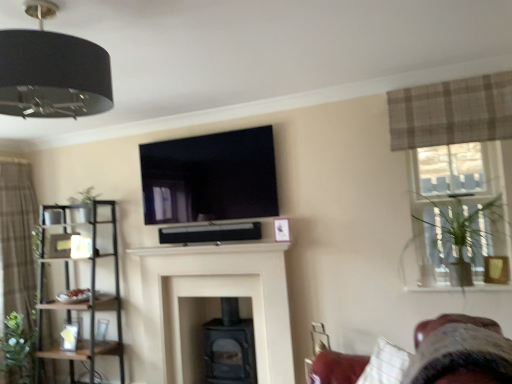
Find the location of a particular element. This screenshot has height=384, width=512. black matte fireplace at center, which is the first fireplace from back to front is located at coordinates (206, 320).

What is the approximate width of clear glass window at upper right?

clear glass window at upper right is 2.96 inches in width.

What do you see at coordinates (17, 242) in the screenshot?
I see `brown textured curtain at left, the 1th curtain positioned from the left` at bounding box center [17, 242].

Image resolution: width=512 pixels, height=384 pixels. In order to click on black matte fireplace at center, which is the first fireplace from back to front in this screenshot , I will do `click(206, 320)`.

Considering the relative sizes of green matte plant at upper left, which appears as the second plant when ordered from the bottom, and black glossy tv at upper center in the image provided, is green matte plant at upper left, which appears as the second plant when ordered from the bottom, bigger than black glossy tv at upper center?

No, green matte plant at upper left, which appears as the second plant when ordered from the bottom, is not bigger than black glossy tv at upper center.

From a real-world perspective, which object stands above the other?

black glossy tv at upper center.

Considering their positions, is green matte plant at upper left, which appears as the second plant when ordered from the bottom, located in front of or behind black glossy tv at upper center?

Clearly, green matte plant at upper left, which appears as the second plant when ordered from the bottom, is behind black glossy tv at upper center.

Is brown textured curtain at left, which appears as the 2th curtain when viewed from the front, completely or partially inside clear glass window at upper right?

No.

Is point (452, 231) closer or farther from the camera than point (18, 250)?

Point (452, 231).

How distant is clear glass window at upper right from brown textured curtain at left, which appears as the 2th curtain when viewed from the front?

3.60 meters.

Identify the location of window located above the brown textured curtain at left, the first curtain ordered from the bottom (from the image's perspective). This screenshot has width=512, height=384. (452, 213).

Does clear glass window at upper right touch green matte plant at upper left, which appears as the second plant when ordered from the bottom?

No, clear glass window at upper right is not making contact with green matte plant at upper left, which appears as the second plant when ordered from the bottom.

Considering the sizes of clear glass window at upper right and green matte plant at upper left, the second plant viewed from the left, in the image, is clear glass window at upper right bigger or smaller than green matte plant at upper left, the second plant viewed from the left,?

Considering their sizes, clear glass window at upper right takes up more space than green matte plant at upper left, the second plant viewed from the left.

Is green matte plant at upper left, arranged as the first plant when viewed from the right, at the back of clear glass window at upper right?

clear glass window at upper right is not turned away from green matte plant at upper left, arranged as the first plant when viewed from the right.

The width and height of the screenshot is (512, 384). Identify the location of plant above the clear glass window at upper right (from a real-world perspective). (85, 203).

Identify the location of shelf behind the clear glass window at upper right. (90, 278).

Considering the positions of objects clear glass window at upper right and black metal shelf at left in the image provided, who is more to the right, clear glass window at upper right or black metal shelf at left?

clear glass window at upper right is more to the right.

Is black metal shelf at left surrounded by clear glass window at upper right?

No, black metal shelf at left is located outside of clear glass window at upper right.

From the image's perspective, between brown textured curtain at left, the first curtain ordered from the bottom, and black matte fireplace at center, which is the first fireplace from back to front, which one is located above?

brown textured curtain at left, the first curtain ordered from the bottom.

Identify the location of the 2nd fireplace below the brown textured curtain at left, the first curtain ordered from the bottom (from the image's perspective). (206, 320).

Can you confirm if brown textured curtain at left, the 1th curtain positioned from the left, is shorter than black matte fireplace at center, which is the first fireplace from back to front?

No, brown textured curtain at left, the 1th curtain positioned from the left, is not shorter than black matte fireplace at center, which is the first fireplace from back to front.

Does black glossy tv at upper center turn towards brown textured curtain at left, the second curtain positioned from the right?

No, black glossy tv at upper center does not turn towards brown textured curtain at left, the second curtain positioned from the right.

Identify the location of window screen lying on the right of brown textured curtain at left, the first curtain ordered from the bottom. (210, 177).

From the image's perspective, which one is positioned higher, black glossy tv at upper center or brown textured curtain at left, which appears as the 2th curtain when viewed from the front?

black glossy tv at upper center, from the image's perspective.

From a real-world perspective, between black glossy tv at upper center and brown textured curtain at left, the first curtain in the back-to-front sequence, who is vertically higher?

From a 3D spatial view, black glossy tv at upper center is above.

In terms of size, does matte black fireplace at center, the first fireplace from the front, appear bigger or smaller than clear glass window at upper right?

matte black fireplace at center, the first fireplace from the front, is bigger than clear glass window at upper right.

From the image's perspective, does matte black fireplace at center, which ranks as the 2th fireplace in back-to-front order, appear lower than clear glass window at upper right?

Yes, from the image's perspective, matte black fireplace at center, which ranks as the 2th fireplace in back-to-front order, is beneath clear glass window at upper right.

Considering the positions of points (139, 262) and (462, 148), is point (139, 262) farther from camera compared to point (462, 148)?

Yes, point (139, 262) is farther from viewer.

Is matte black fireplace at center, the first fireplace from the front, far away from clear glass window at upper right?

Absolutely, matte black fireplace at center, the first fireplace from the front, is distant from clear glass window at upper right.

This screenshot has height=384, width=512. Identify the location of window screen in front of the green matte plant at upper left, which appears as the second plant when ordered from the bottom. point(210,177).

At what (x,y) coordinates should I click in order to perform the action: click on the 2nd curtain to the left when counting from the clear glass window at upper right. Please return your answer as a coordinate pair (x, y). Looking at the image, I should click on (17, 242).

Based on their spatial positions, is green matte plant at upper left, which appears as the second plant when ordered from the bottom, or matte black fireplace at center, the first fireplace from the front, further from black metal shelf at left?

Among the two, matte black fireplace at center, the first fireplace from the front, is located further to black metal shelf at left.

From the image, which object appears to be nearer to white matte fireplace at center, plush fabric swivel chair at lower right or black glossy tv at upper center?

black glossy tv at upper center lies closer to white matte fireplace at center than the other object.

Estimate the real-world distances between objects in this image. Which object is closer to plaid fabric curtain at upper right, the 1th curtain positioned from the top, black fabric lampshade at upper left or clear glass window at upper right?

clear glass window at upper right is positioned closer to the anchor plaid fabric curtain at upper right, the 1th curtain positioned from the top.

Looking at the image, which one is located further to plaid fabric curtain at upper right, the 1th curtain positioned from the top, green matte plant at upper left, which appears as the second plant when ordered from the bottom, or white matte fireplace at center?

green matte plant at upper left, which appears as the second plant when ordered from the bottom, lies further to plaid fabric curtain at upper right, the 1th curtain positioned from the top, than the other object.

Looking at the image, which one is located closer to black glossy tv at upper center, black matte fireplace at center, arranged as the 2th fireplace when viewed from the front, or plaid fabric curtain at upper right, the 1th curtain positioned from the top?

black matte fireplace at center, arranged as the 2th fireplace when viewed from the front, is closer to black glossy tv at upper center.

Based on their spatial positions, is black metal shelf at left or black glossy tv at upper center further from brown textured curtain at left, the first curtain in the back-to-front sequence?

Among the two, black glossy tv at upper center is located further to brown textured curtain at left, the first curtain in the back-to-front sequence.

Based on their spatial positions, is plaid fabric curtain at upper right, positioned as the first curtain in right-to-left order, or white matte fireplace at center closer to matte black fireplace at center, which ranks as the 2th fireplace in back-to-front order?

Among the two, white matte fireplace at center is located nearer to matte black fireplace at center, which ranks as the 2th fireplace in back-to-front order.

Based on their spatial positions, is black matte fireplace at center, arranged as the 2th fireplace when viewed from the front, or plush fabric swivel chair at lower right further from green matte plant at upper left, which appears as the second plant when ordered from the bottom?

plush fabric swivel chair at lower right lies further to green matte plant at upper left, which appears as the second plant when ordered from the bottom, than the other object.

Where is `light fixture between green leafy plant at left, which is the second plant from top to bottom, and clear glass window at upper right, in the horizontal direction`? light fixture between green leafy plant at left, which is the second plant from top to bottom, and clear glass window at upper right, in the horizontal direction is located at coordinates (52, 71).

Where is `mantle between black metal shelf at left and black matte fireplace at center, arranged as the 2th fireplace when viewed from the front, from left to right`? mantle between black metal shelf at left and black matte fireplace at center, arranged as the 2th fireplace when viewed from the front, from left to right is located at coordinates (212, 248).

Locate an element on the screen. The width and height of the screenshot is (512, 384). mantle situated between black metal shelf at left and clear glass window at upper right from left to right is located at coordinates (212, 248).

Where is `shelf located between green leafy plant at left, marked as the first plant in a bottom-to-top arrangement, and clear glass window at upper right in the left-right direction`? shelf located between green leafy plant at left, marked as the first plant in a bottom-to-top arrangement, and clear glass window at upper right in the left-right direction is located at coordinates (90, 278).